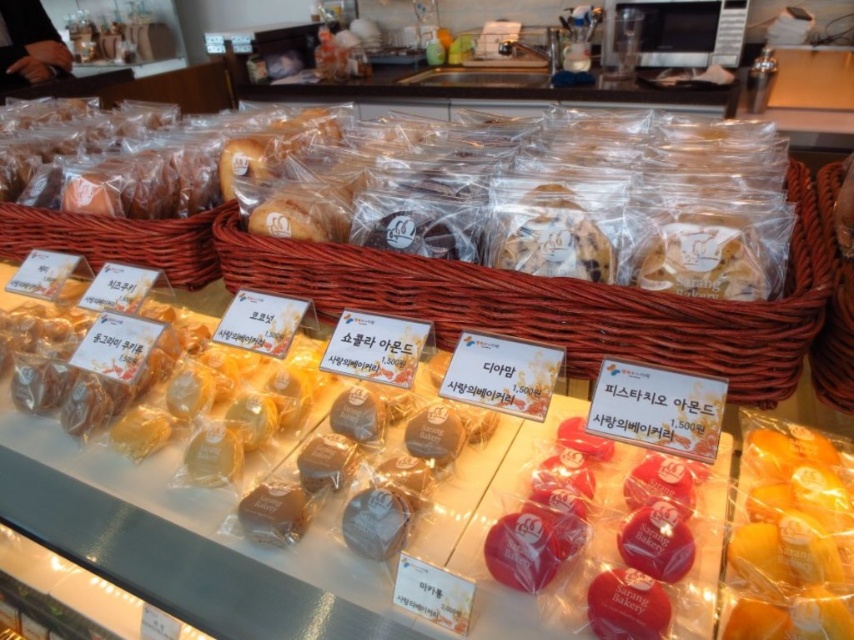
Who is positioned more to the left, brown woven basket at upper center or brown woven basket at right?

From the viewer's perspective, brown woven basket at upper center appears more on the left side.

This screenshot has width=854, height=640. What do you see at coordinates (560, 301) in the screenshot?
I see `brown woven basket at upper center` at bounding box center [560, 301].

Where is `brown woven basket at upper center`? This screenshot has height=640, width=854. brown woven basket at upper center is located at coordinates (560, 301).